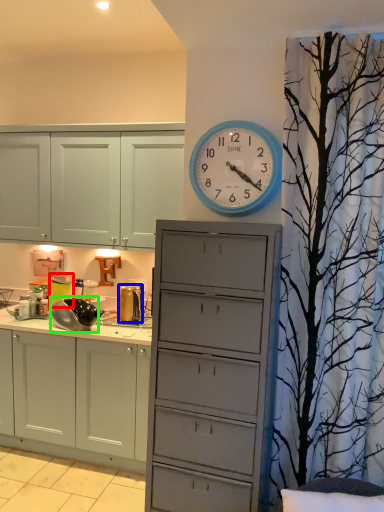
Question: Based on their relative distances, which object is farther from appliance (highlighted by a red box)? Choose from appliance (highlighted by a blue box) and appliance (highlighted by a green box).

Choices:
 (A) appliance
 (B) appliance

Answer: (A)